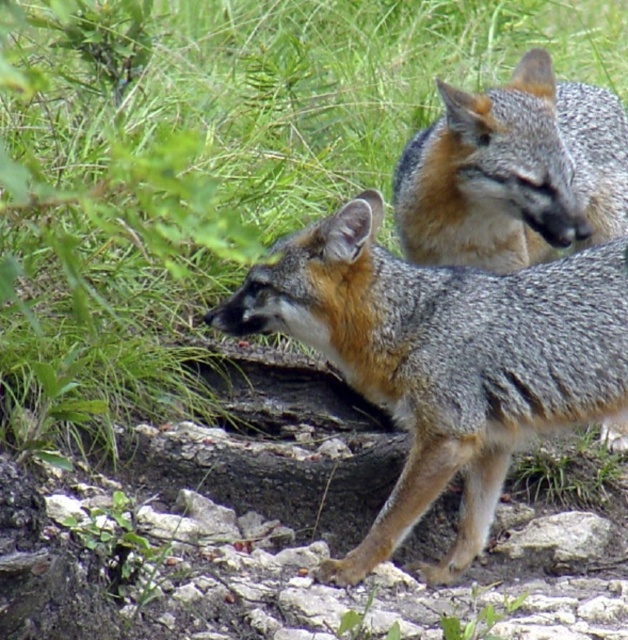
You are a small animal trying to jump from the green leafy grass at upper left to the gray fur fox at center. Can you make the jump if your maximum jump distance is 1 meter?

The distance between the green leafy grass at upper left and the gray fur fox at center is 96.15 centimeters. Since your maximum jump distance is 1 meter, you can make the jump.

You are a photographer trying to capture both foxes in a single shot. You notice two points marked in the scene. Which point is closer to you, point (106, 76) or point (489, 193)?

Point (106, 76) is closer to you than point (489, 193) because it is further to the viewer according to the description.